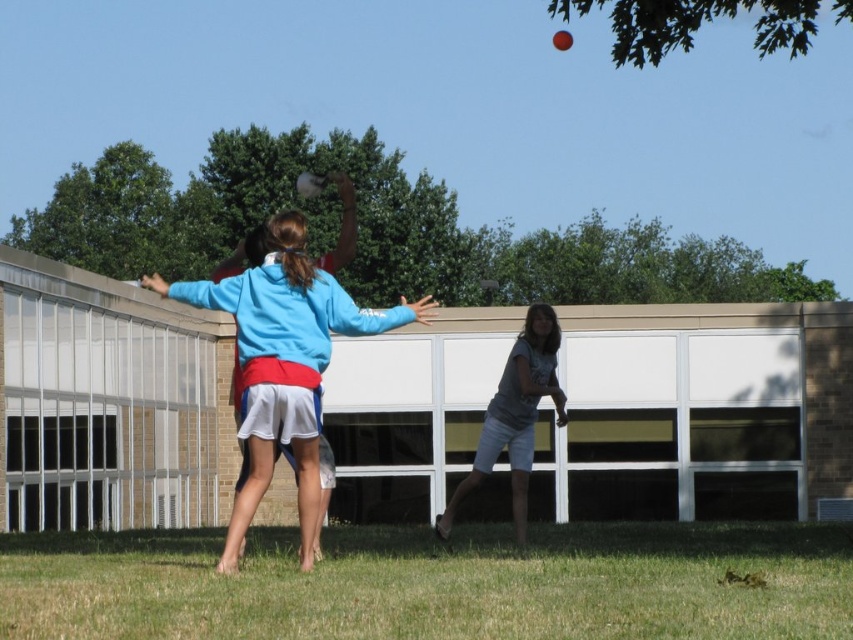
Does point (305, 541) lie in front of point (521, 417)?

Yes, it is.

You are a GUI agent. You are given a task and a screenshot of the screen. Output one action in this format:
    pyautogui.click(x=<x>, y=<y>)
    Task: Click on the blue fabric jacket at center
    The height and width of the screenshot is (640, 853).
    Given the screenshot: What is the action you would take?
    pyautogui.click(x=283, y=362)

At what (x,y) coordinates should I click in order to perform the action: click on blue fabric jacket at center. Please return your answer as a coordinate pair (x, y). Looking at the image, I should click on (283, 362).